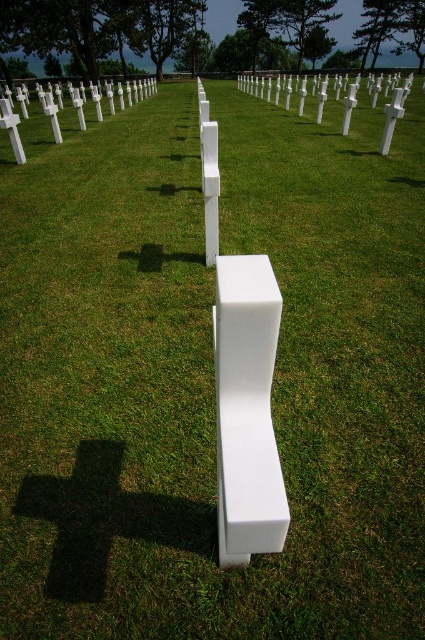
Can you confirm if white matte cross at center is wider than white matte cross at upper left?

Yes.

Is white matte cross at center positioned in front of white matte cross at upper left?

No, it is behind white matte cross at upper left.

Measure the distance between point (311, 84) and camera.

Point (311, 84) and camera are 40.32 meters apart from each other.

I want to click on white matte cross at center, so [286, 92].